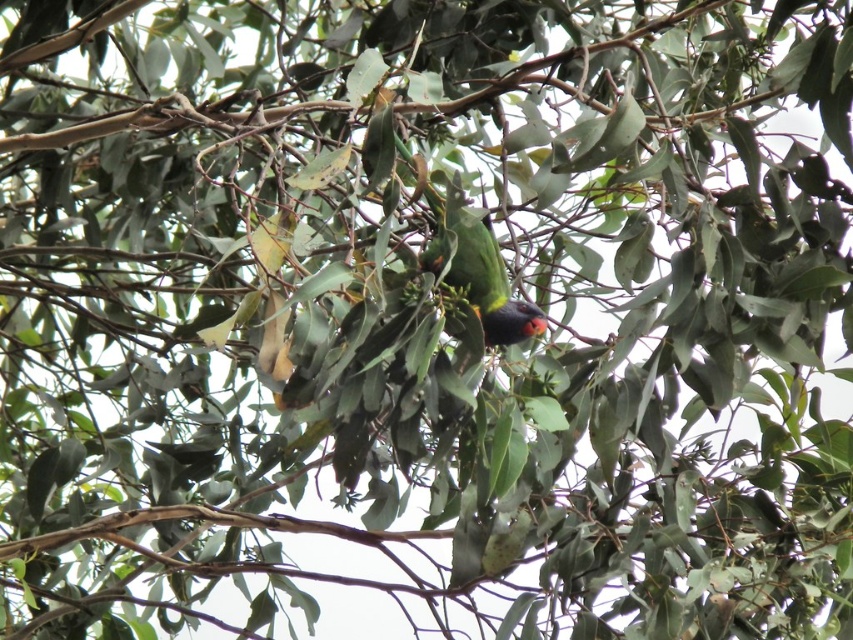
Question: Among these points, which one is farthest from the camera?

Choices:
 (A) (102, 129)
 (B) (497, 291)

Answer: (A)

Question: Does green leafy branch at center come in front of multicolored glossy parrot at center?

Choices:
 (A) no
 (B) yes

Answer: (A)

Question: Which point is farther from the camera taking this photo?

Choices:
 (A) (496, 300)
 (B) (527, 67)

Answer: (A)

Question: Is the position of green leafy branch at center less distant than that of multicolored glossy parrot at center?

Choices:
 (A) yes
 (B) no

Answer: (B)

Question: Can you confirm if green leafy branch at center is positioned above multicolored glossy parrot at center?

Choices:
 (A) yes
 (B) no

Answer: (A)

Question: Which of the following is the closest to the observer?

Choices:
 (A) (476, 97)
 (B) (490, 234)

Answer: (A)